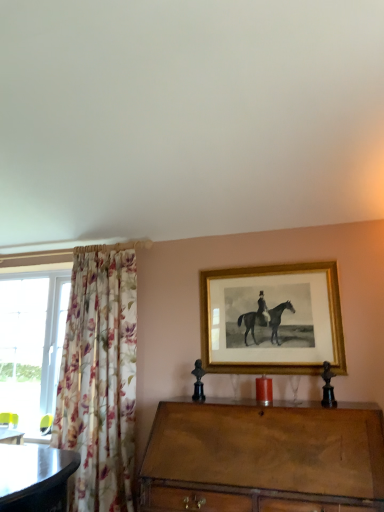
The width and height of the screenshot is (384, 512). What do you see at coordinates (263, 457) in the screenshot?
I see `wooden chest of drawers at center` at bounding box center [263, 457].

Where is `brown wooden desk at lower left`? brown wooden desk at lower left is located at coordinates (11, 436).

What is the approximate height of brown wooden desk at lower left?

The height of brown wooden desk at lower left is 3.71 inches.

Image resolution: width=384 pixels, height=512 pixels. What are the coordinates of `gold/gilded picture frame at upper center` in the screenshot? It's located at (272, 320).

Locate an element on the screen. floral fabric curtain at left is located at coordinates (100, 378).

Can you see wooden chest of drawers at center touching brown wooden desk at lower left?

wooden chest of drawers at center is not next to brown wooden desk at lower left, and they're not touching.

From their relative heights in the image, would you say wooden chest of drawers at center is taller or shorter than brown wooden desk at lower left?

In the image, wooden chest of drawers at center appears to be taller than brown wooden desk at lower left.

The image size is (384, 512). I want to click on the chest of drawers directly beneath the brown wooden desk at lower left (from a real-world perspective), so click(x=263, y=457).

Which is behind, wooden chest of drawers at center or brown wooden desk at lower left?

brown wooden desk at lower left.

From a real-world perspective, who is located higher, wooden chest of drawers at center or floral fabric curtain at left?

floral fabric curtain at left, from a real-world perspective.

Considering the sizes of objects wooden chest of drawers at center and floral fabric curtain at left in the image provided, who is shorter, wooden chest of drawers at center or floral fabric curtain at left?

Standing shorter between the two is wooden chest of drawers at center.

Is wooden chest of drawers at center oriented towards floral fabric curtain at left?

No, wooden chest of drawers at center does not turn towards floral fabric curtain at left.

Considering the positions of points (159, 478) and (251, 362), is point (159, 478) closer to camera compared to point (251, 362)?

That is True.

Is wooden chest of drawers at center smaller than gold/gilded picture frame at upper center?

Actually, wooden chest of drawers at center might be larger than gold/gilded picture frame at upper center.

Does wooden chest of drawers at center have a lesser height compared to gold/gilded picture frame at upper center?

In fact, wooden chest of drawers at center may be taller than gold/gilded picture frame at upper center.

From a real-world perspective, is gold/gilded picture frame at upper center over brown wooden desk at lower left?

Yes, from a real-world perspective, gold/gilded picture frame at upper center is above brown wooden desk at lower left.

You are a GUI agent. You are given a task and a screenshot of the screen. Output one action in this format:
    pyautogui.click(x=<x>, y=<y>)
    Task: Click on the picture frame on the right side of brown wooden desk at lower left
    This screenshot has height=512, width=384.
    Given the screenshot: What is the action you would take?
    pyautogui.click(x=272, y=320)

Which object is further away from the camera, gold/gilded picture frame at upper center or brown wooden desk at lower left?

Positioned behind is brown wooden desk at lower left.

Consider the image. Would you say gold/gilded picture frame at upper center is inside or outside brown wooden desk at lower left?

gold/gilded picture frame at upper center is spatially situated outside brown wooden desk at lower left.

Image resolution: width=384 pixels, height=512 pixels. I want to click on picture frame above the floral fabric curtain at left (from a real-world perspective), so click(272, 320).

Consider the image. Considering the relative positions of floral fabric curtain at left and gold/gilded picture frame at upper center in the image provided, is floral fabric curtain at left in front of gold/gilded picture frame at upper center?

Yes.

Is floral fabric curtain at left facing away from gold/gilded picture frame at upper center?

floral fabric curtain at left does not have its back to gold/gilded picture frame at upper center.

Can you confirm if floral fabric curtain at left is bigger than gold/gilded picture frame at upper center?

Yes, floral fabric curtain at left is bigger than gold/gilded picture frame at upper center.

Between brown wooden desk at lower left and gold/gilded picture frame at upper center, which one has larger size?

gold/gilded picture frame at upper center is bigger.

Is brown wooden desk at lower left beside gold/gilded picture frame at upper center?

No, brown wooden desk at lower left is not in contact with gold/gilded picture frame at upper center.

Which is in front, point (15, 439) or point (322, 317)?

The point (322, 317) is closer to the camera.

Who is shorter, brown wooden desk at lower left or gold/gilded picture frame at upper center?

brown wooden desk at lower left.

Which of these two, floral fabric curtain at left or wooden chest of drawers at center, stands shorter?

wooden chest of drawers at center is shorter.

From a real-world perspective, which object rests below the other?

wooden chest of drawers at center.

Is floral fabric curtain at left in front of or behind wooden chest of drawers at center in the image?

floral fabric curtain at left is behind wooden chest of drawers at center.

Where is `the chest of drawers located in front of the brown wooden desk at lower left`? The image size is (384, 512). the chest of drawers located in front of the brown wooden desk at lower left is located at coordinates (263, 457).

Image resolution: width=384 pixels, height=512 pixels. I want to click on the chest of drawers directly beneath the floral fabric curtain at left (from a real-world perspective), so click(x=263, y=457).

From the image, which object appears to be nearer to wooden chest of drawers at center, floral fabric curtain at left or gold/gilded picture frame at upper center?

gold/gilded picture frame at upper center is positioned closer to the anchor wooden chest of drawers at center.

Based on their spatial positions, is brown wooden desk at lower left or floral fabric curtain at left closer to wooden chest of drawers at center?

The object closer to wooden chest of drawers at center is floral fabric curtain at left.

Which object lies further to the anchor point gold/gilded picture frame at upper center, floral fabric curtain at left or wooden chest of drawers at center?

floral fabric curtain at left.

From the image, which object appears to be nearer to gold/gilded picture frame at upper center, brown wooden desk at lower left or wooden chest of drawers at center?

Among the two, wooden chest of drawers at center is located nearer to gold/gilded picture frame at upper center.

Looking at the image, which one is located closer to floral fabric curtain at left, gold/gilded picture frame at upper center or wooden chest of drawers at center?

gold/gilded picture frame at upper center is closer to floral fabric curtain at left.

When comparing their distances from wooden chest of drawers at center, does gold/gilded picture frame at upper center or brown wooden desk at lower left seem further?

brown wooden desk at lower left is positioned further to the anchor wooden chest of drawers at center.

Looking at the image, which one is located closer to gold/gilded picture frame at upper center, wooden chest of drawers at center or brown wooden desk at lower left?

The object closer to gold/gilded picture frame at upper center is wooden chest of drawers at center.

When comparing their distances from floral fabric curtain at left, does wooden chest of drawers at center or brown wooden desk at lower left seem closer?

brown wooden desk at lower left lies closer to floral fabric curtain at left than the other object.

Image resolution: width=384 pixels, height=512 pixels. I want to click on curtain between brown wooden desk at lower left and gold/gilded picture frame at upper center, so click(x=100, y=378).

Find the location of `curtain situated between brown wooden desk at lower left and wooden chest of drawers at center from left to right`. curtain situated between brown wooden desk at lower left and wooden chest of drawers at center from left to right is located at coordinates (100, 378).

Find the location of `chest of drawers between floral fabric curtain at left and gold/gilded picture frame at upper center in the horizontal direction`. chest of drawers between floral fabric curtain at left and gold/gilded picture frame at upper center in the horizontal direction is located at coordinates (263, 457).

You are a GUI agent. You are given a task and a screenshot of the screen. Output one action in this format:
    pyautogui.click(x=<x>, y=<y>)
    Task: Click on the chest of drawers located between brown wooden desk at lower left and gold/gilded picture frame at upper center in the left-right direction
    
    Given the screenshot: What is the action you would take?
    pyautogui.click(x=263, y=457)